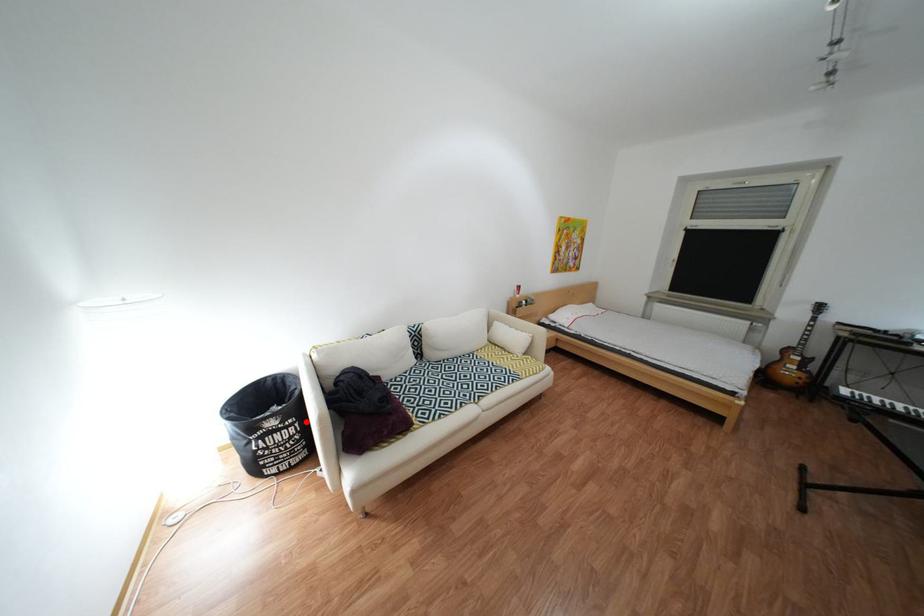
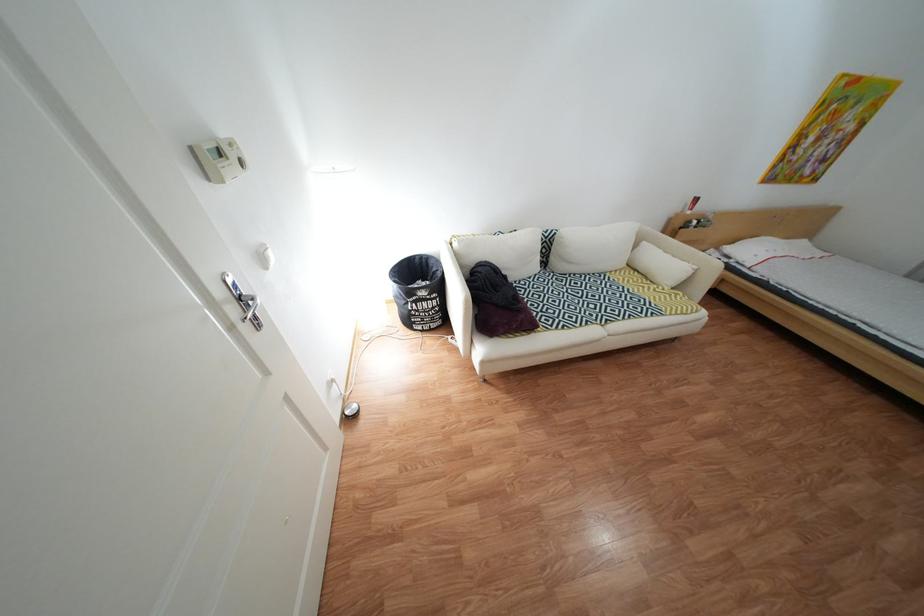
Find the pixel in the second image that matches the highlighted location in the first image.

(450, 296)